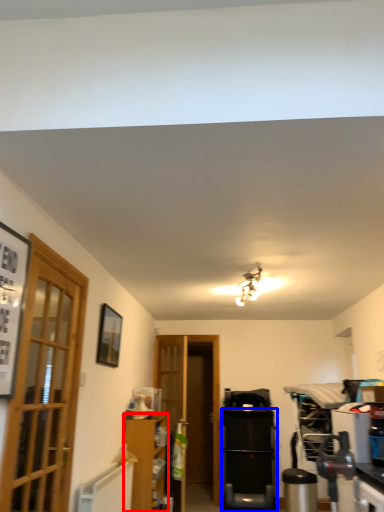
Question: Which of the following is the closest to the observer, cabinetry (highlighted by a red box) or appliance (highlighted by a blue box)?

Choices:
 (A) cabinetry
 (B) appliance

Answer: (A)